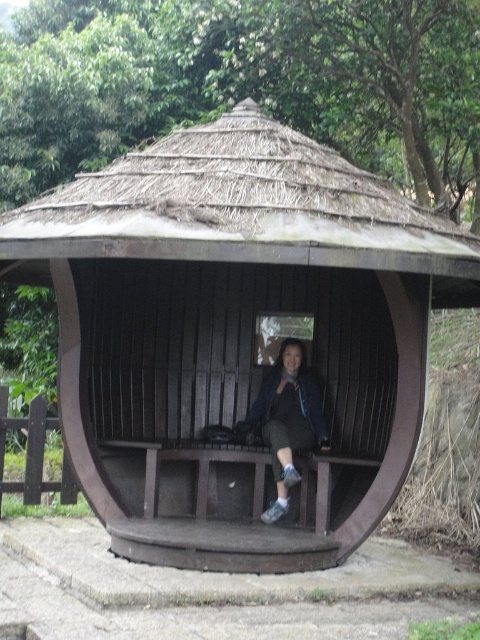
Between brown wooden gazebo at center and matte blue jacket at center, which one is positioned higher?

Positioned higher is brown wooden gazebo at center.

Does brown wooden gazebo at center have a greater height compared to matte blue jacket at center?

Yes.

In order to click on brown wooden gazebo at center in this screenshot , I will do `click(236, 333)`.